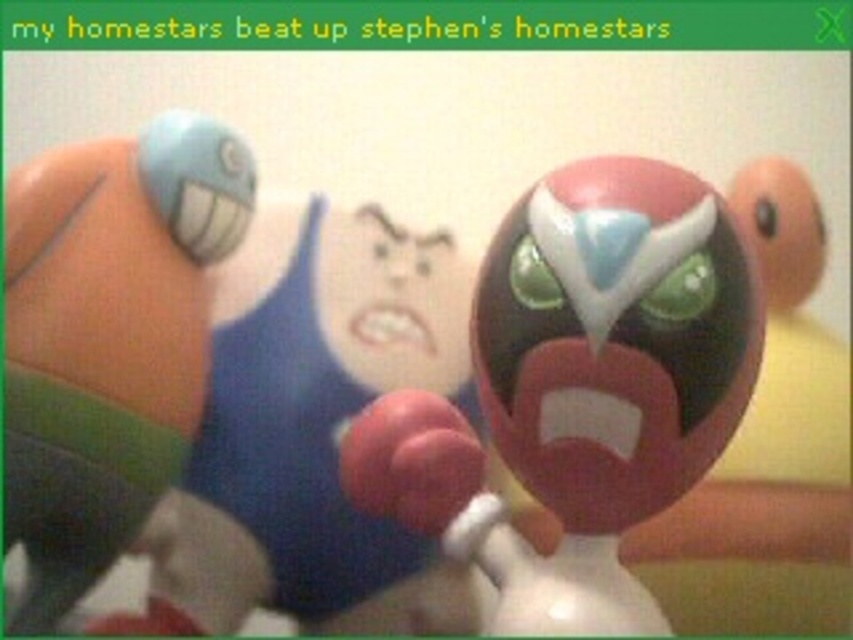
You are a collector organizing a display case for Homestar Runner figurines. You have a shiny plastic toy at center and a matte plastic toy at left. According to the scene description, which toy is placed lower in the display?

The shiny plastic toy at center is positioned under the matte plastic toy at left, so it is placed lower in the display.

You are a collector trying to arrange two Homestar Runner figurines on a shelf. You have a shiny plastic toy at center and a matte plastic toy at left. If you want to place them side by side without overlapping, which one should you place first to accommodate their widths?

The shiny plastic toy at center is wider than the matte plastic toy at left, so you should place the shiny plastic toy at center first to ensure there is enough space for both on the shelf.

You are a collector trying to display your Homestar Runner figurines on a shelf. You have two toys in front of you, a shiny plastic toy at center and a matte plastic toy at left. Which one will you need to place first if you want to arrange them from shortest to tallest?

The shiny plastic toy at center is not as tall as the matte plastic toy at left, so you should place the shiny plastic toy at center first followed by the matte plastic toy at left to arrange them from shortest to tallest.